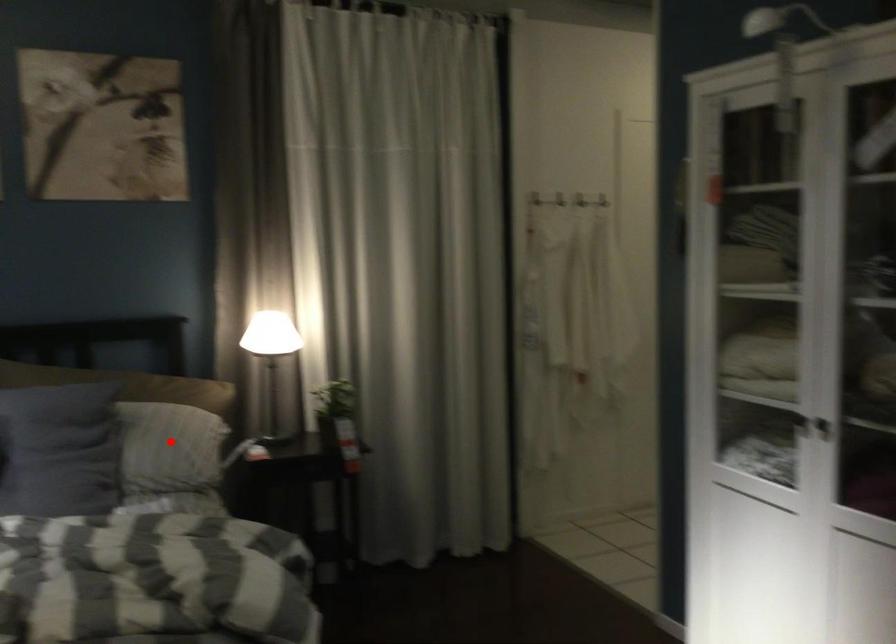
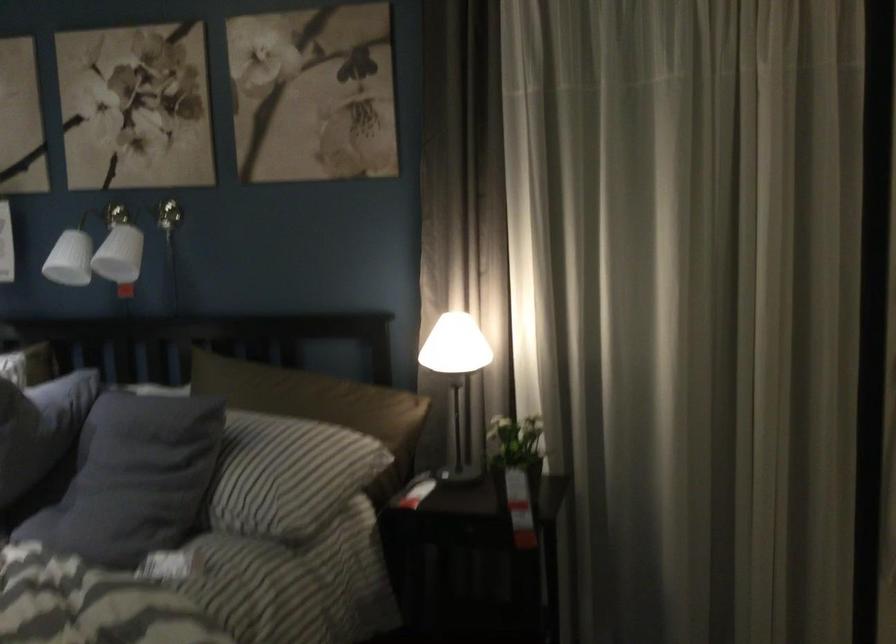
Find the pixel in the second image that matches the highlighted location in the first image.

(280, 471)